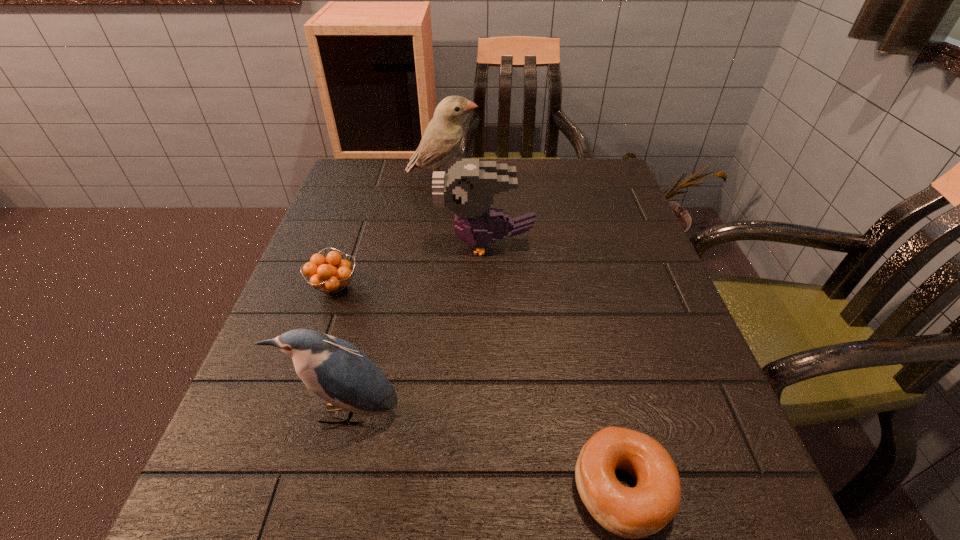
I want to click on free location located on the back of the orange fruit, so click(x=363, y=204).

Where is `object present at the far edge`? The width and height of the screenshot is (960, 540). object present at the far edge is located at coordinates (443, 135).

Locate an element on the screen. The image size is (960, 540). bird that is at the left edge is located at coordinates (335, 370).

Find the location of a particular element. orange fruit that is positioned at the left edge is located at coordinates (331, 274).

Locate an element on the screen. Image resolution: width=960 pixels, height=540 pixels. free space at the far edge of the desktop is located at coordinates (560, 178).

Where is `free spot at the left edge of the desktop`? free spot at the left edge of the desktop is located at coordinates (325, 213).

Where is `free location at the right edge`? This screenshot has height=540, width=960. free location at the right edge is located at coordinates (627, 219).

The image size is (960, 540). In the image, there is a desktop. Find the location of `free space at the far left corner`. free space at the far left corner is located at coordinates (358, 195).

The width and height of the screenshot is (960, 540). In order to click on free space at the far right corner in this screenshot , I will do `click(564, 185)`.

Find the location of a particular element. The width and height of the screenshot is (960, 540). vacant region at the near right corner of the desktop is located at coordinates (682, 529).